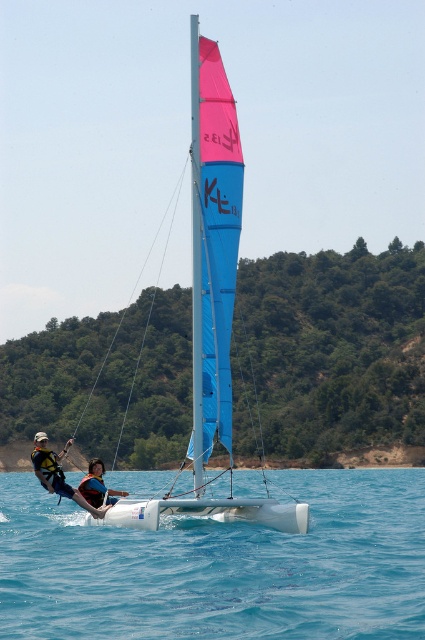
Can you confirm if clear blue water at center is bigger than white life vest at lower left?

Indeed, clear blue water at center has a larger size compared to white life vest at lower left.

Which is in front, point (90, 600) or point (47, 436)?

Point (90, 600) is in front.

Does point (201, 579) lie in front of point (42, 483)?

Yes.

This screenshot has width=425, height=640. Identify the location of clear blue water at center. (220, 566).

Is blue fabric sailboat at center shorter than white life vest at lower left?

No.

Identify the location of blue fabric sailboat at center. (212, 300).

The height and width of the screenshot is (640, 425). Identify the location of blue fabric sailboat at center. (212, 300).

What are the coordinates of `blue fabric sailboat at center` in the screenshot? It's located at (212, 300).

Can you confirm if clear blue water at center is thinner than blue fabric sailboat at center?

In fact, clear blue water at center might be wider than blue fabric sailboat at center.

Is point (93, 630) farther from viewer compared to point (221, 518)?

No.

Who is more distant from viewer, (320, 577) or (209, 440)?

Positioned behind is point (209, 440).

Where is `clear blue water at center`? clear blue water at center is located at coordinates (220, 566).